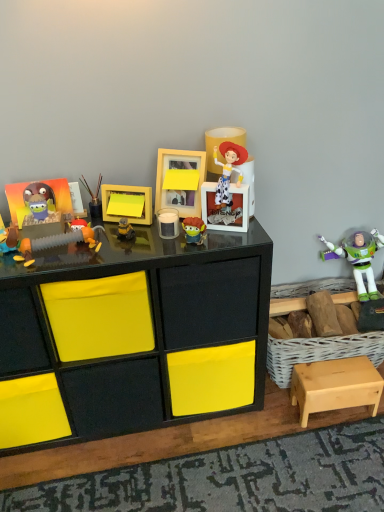
Question: Looking at their shapes, would you say metallic paintbrushes at center, which is the fourth toy in right-to-left order, is wider or thinner than black glossy desk at center?

Choices:
 (A) wide
 (B) thin

Answer: (B)

Question: From the image's perspective, is metallic paintbrushes at center, which appears as the fourth toy when viewed from the left, above or below black glossy desk at center?

Choices:
 (A) above
 (B) below

Answer: (A)

Question: Estimate the real-world distances between objects in this image. Which object is farther from the metallic paintbrushes at center, which appears as the fourth toy when viewed from the left?

Choices:
 (A) wooden picture frame at center, which ranks as the 1th picture frame in right-to-left order
 (B) matte orange toy at center-left, which ranks as the 5th toy in right-to-left order
 (C) matte plastic toy at center, the 2th toy viewed from the right
 (D) yellow matte picture frame at center, the first picture frame positioned from the left
 (E) white plastic buzz lightyear figure at upper right, the first toy when ordered from right to left

Answer: (E)

Question: Which object is positioned closest to the metallic paintbrushes at center, which is the fourth toy in right-to-left order?

Choices:
 (A) matte plastic toy at left, which is the first toy from left to right
 (B) white wicker basket at right
 (C) black glossy desk at center
 (D) white plastic buzz lightyear figure at upper right, the first toy when ordered from right to left
 (E) plush toy at left, which appears as the 6th toy when viewed from the right

Answer: (E)